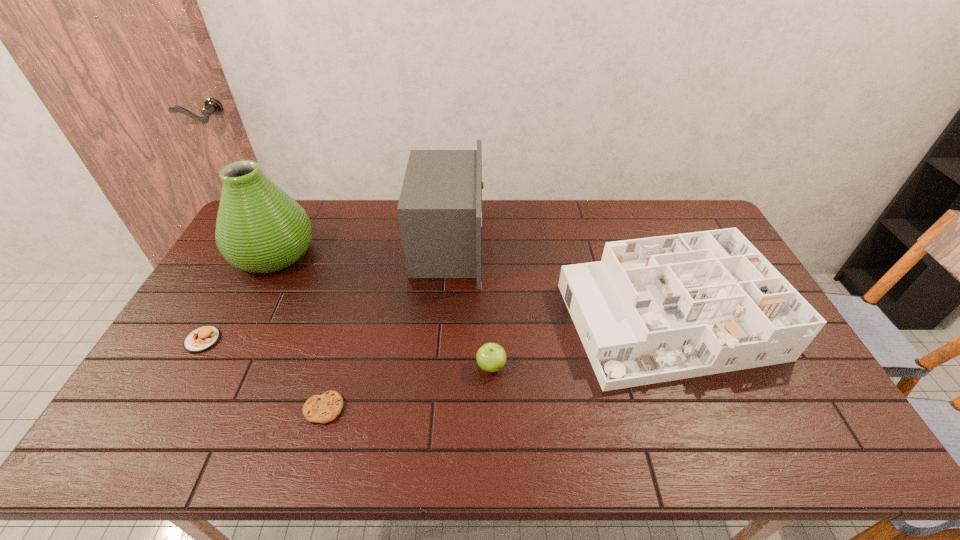
Identify the location of object that is at the far left corner. Image resolution: width=960 pixels, height=540 pixels. (260, 229).

You are a GUI agent. You are given a task and a screenshot of the screen. Output one action in this format:
    pyautogui.click(x=<x>, y=<y>)
    Task: Click on the free space at the far edge of the desktop
    Image resolution: width=960 pixels, height=540 pixels.
    Given the screenshot: What is the action you would take?
    pyautogui.click(x=548, y=238)

Where is `vacant position at the near edge of the desktop`? vacant position at the near edge of the desktop is located at coordinates click(735, 436).

Find the location of a particular element. The height and width of the screenshot is (540, 960). free space at the left edge of the desktop is located at coordinates (209, 288).

Locate an element on the screen. The image size is (960, 540). vacant space at the near right corner of the desktop is located at coordinates (806, 426).

You are a GUI agent. You are given a task and a screenshot of the screen. Output one action in this format:
    pyautogui.click(x=<x>, y=<y>)
    Task: Click on the vacant region between the microwave oven and the apple
    This screenshot has height=540, width=960.
    Given the screenshot: What is the action you would take?
    pyautogui.click(x=469, y=305)

Locate an element on the screen. vacant area between the patty and the apple is located at coordinates (347, 353).

You are a GUI agent. You are given a task and a screenshot of the screen. Output one action in this format:
    pyautogui.click(x=<x>, y=<y>)
    Task: Click on the free space between the patty and the rightmost object
    The image size is (960, 540).
    Given the screenshot: What is the action you would take?
    pyautogui.click(x=435, y=330)

The width and height of the screenshot is (960, 540). In order to click on vacant area between the microwave oven and the rightmost object in this screenshot , I will do `click(558, 282)`.

What are the coordinates of `free point between the nearest object and the apple` in the screenshot? It's located at tap(408, 387).